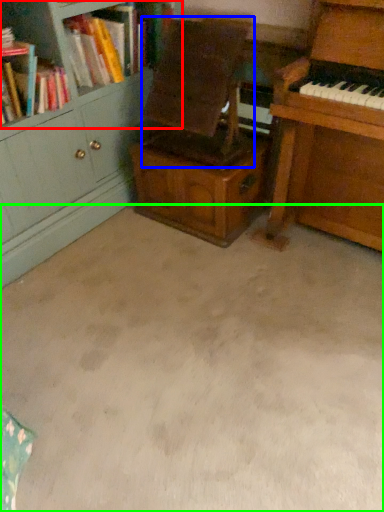
Question: Considering the real-world distances, which object is farthest from bookcase (highlighted by a red box)? armchair (highlighted by a blue box) or plain (highlighted by a green box)?

Choices:
 (A) armchair
 (B) plain

Answer: (B)